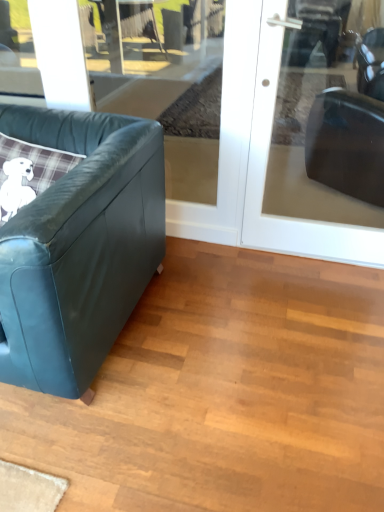
At what (x,y) coordinates should I click in order to perform the action: click on vacant location below transparent glass door at upper right (from a real-world perspective). Please return your answer as a coordinate pair (x, y). Looking at the image, I should click on (314, 259).